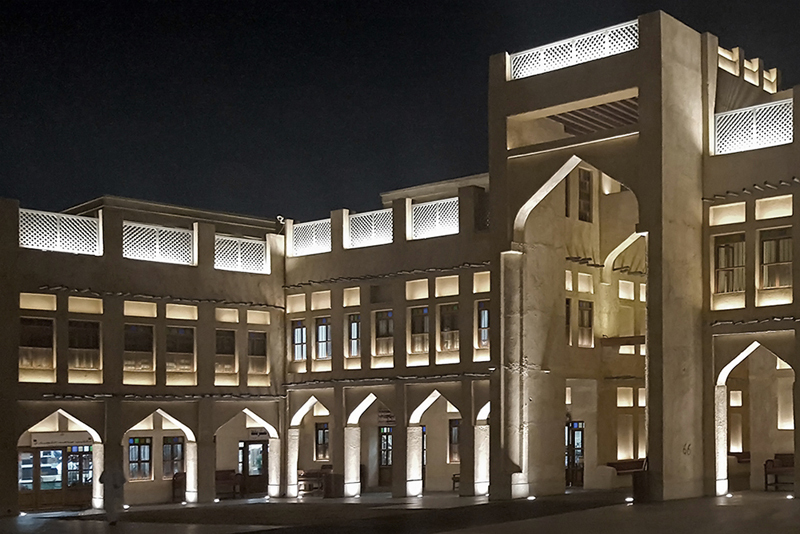
At what (x,y) coordinates should I click in order to perform the action: click on columns. Please return your answer as a coordinate pair (x, y). The height and width of the screenshot is (534, 800). Looking at the image, I should click on (14, 488), (117, 479), (202, 479), (281, 464), (350, 460), (402, 460), (469, 460).